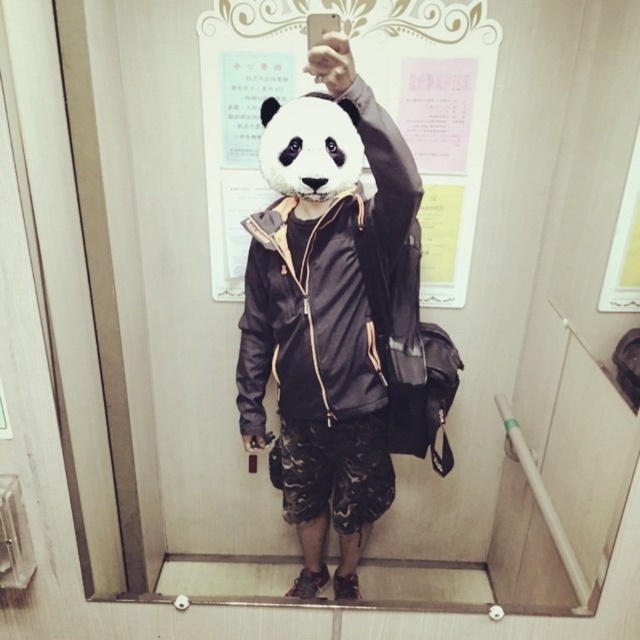
Question: Can you confirm if matte white paper at upper center is positioned to the left of white matte panda at center?

Choices:
 (A) yes
 (B) no

Answer: (B)

Question: Can you confirm if matte white paper at upper center is positioned above white matte panda at center?

Choices:
 (A) no
 (B) yes

Answer: (B)

Question: Which object is farther from the camera taking this photo?

Choices:
 (A) matte black jacket at center
 (B) matte white paper at upper center
 (C) white matte panda at center

Answer: (B)

Question: Which point is closer to the camera?

Choices:
 (A) (317, 115)
 (B) (216, 243)

Answer: (A)

Question: Is matte white paper at upper center bigger than white matte panda at center?

Choices:
 (A) no
 (B) yes

Answer: (B)

Question: Which object appears closest to the camera in this image?

Choices:
 (A) matte white paper at upper center
 (B) matte black jacket at center

Answer: (B)